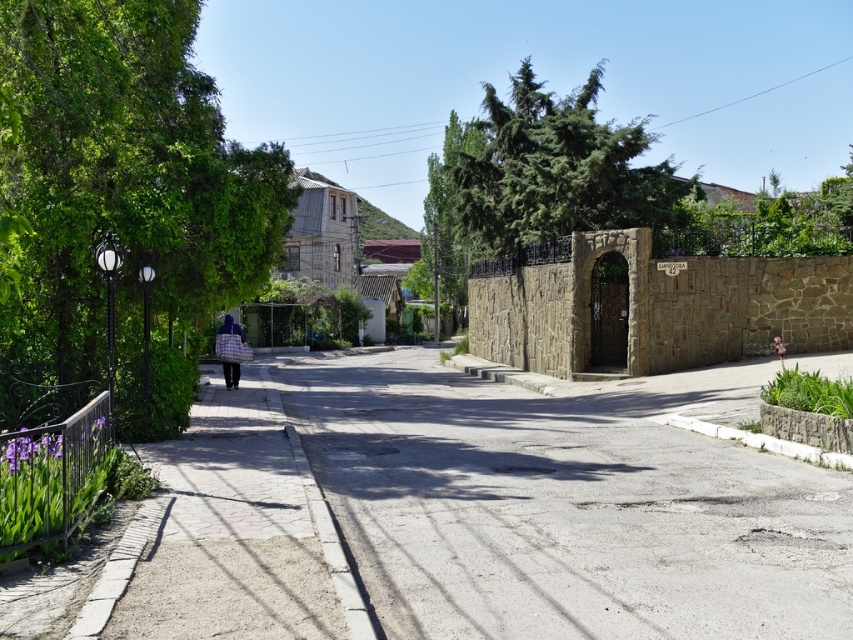
Is point (618, 170) behind point (239, 371)?

Yes, point (618, 170) is farther from viewer.

Which is more to the right, green textured stone gate at center or blue plaid bag at center?

green textured stone gate at center

Is point (669, 186) behind point (238, 365)?

That is True.

Identify the location of green textured stone gate at center. This screenshot has height=640, width=853. (538, 176).

Does gray concrete pavement at center appear on the right side of blue plaid bag at center?

Indeed, gray concrete pavement at center is positioned on the right side of blue plaid bag at center.

Is gray concrete pavement at center smaller than blue plaid bag at center?

Incorrect, gray concrete pavement at center is not smaller in size than blue plaid bag at center.

The width and height of the screenshot is (853, 640). I want to click on gray concrete pavement at center, so click(561, 513).

Is gray concrete pavement at center wider than green leafy tree at left?

Indeed, gray concrete pavement at center has a greater width compared to green leafy tree at left.

Does gray concrete pavement at center appear under green leafy tree at left?

Correct, gray concrete pavement at center is located below green leafy tree at left.

Does point (409, 428) lie behind point (190, 170)?

Yes.

Image resolution: width=853 pixels, height=640 pixels. In order to click on gray concrete pavement at center in this screenshot , I will do `click(561, 513)`.